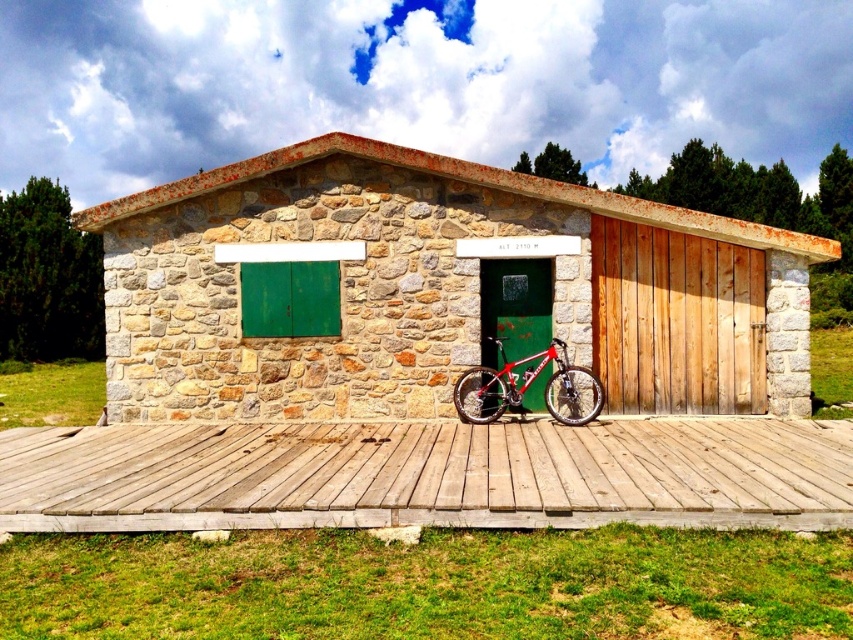
Is stone textured hut at center taller than shiny metallic bicycle at center?

Yes, stone textured hut at center is taller than shiny metallic bicycle at center.

Does point (413, 310) come farther from viewer compared to point (548, 401)?

Yes, it is.

Find the location of a particular element. The height and width of the screenshot is (640, 853). stone textured hut at center is located at coordinates (434, 289).